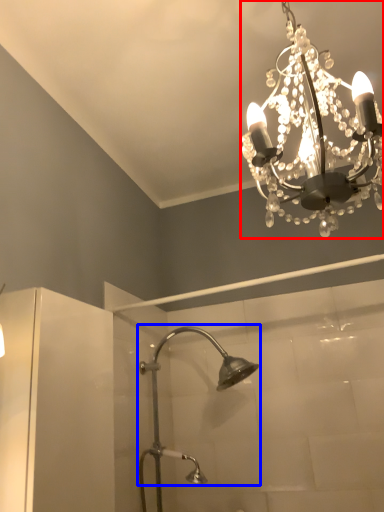
Question: Among these objects, which one is nearest to the camera, lamp (highlighted by a red box) or shower (highlighted by a blue box)?

Choices:
 (A) lamp
 (B) shower

Answer: (A)